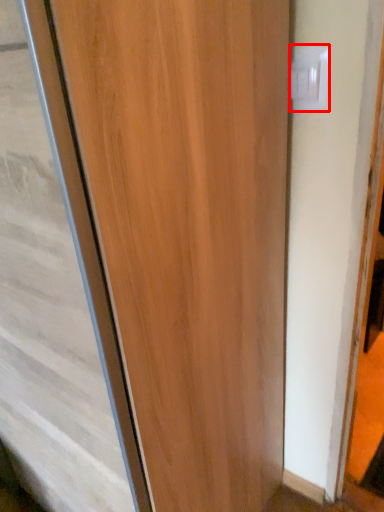
Question: Observing the image, what is the correct spatial positioning of electric outlet (annotated by the red box) in reference to door?

Choices:
 (A) left
 (B) right

Answer: (B)